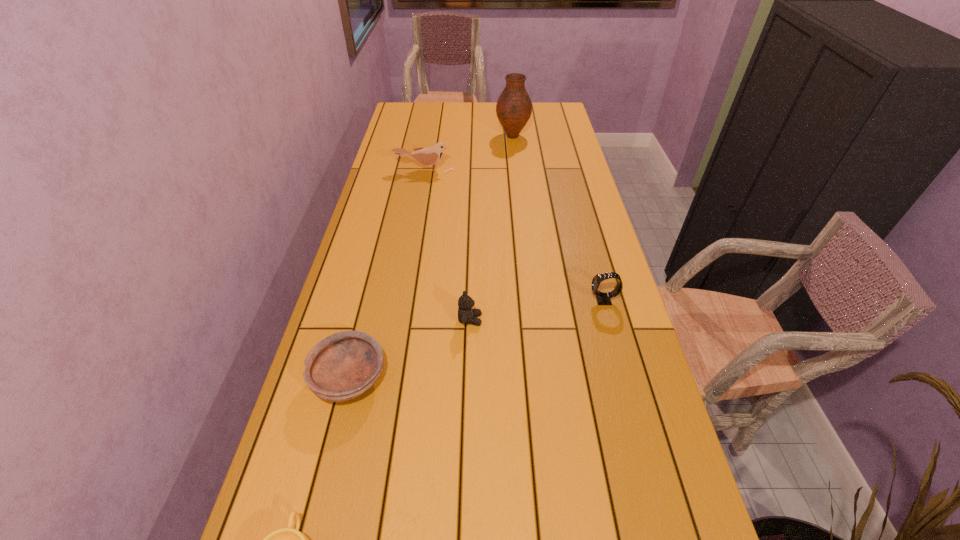
Locate an element on the screen. This screenshot has height=540, width=960. vacant space in between the teddy bear and the fifth farthest object is located at coordinates (410, 349).

This screenshot has height=540, width=960. I want to click on empty space between the bird and the rightmost object, so (514, 235).

Identify which object is the fourth closest to the farthest object. Please provide its 2D coordinates. Your answer should be formatted as a tuple, i.e. [(x, y)], where the tuple contains the x and y coordinates of a point satisfying the conditions above.

[(344, 365)]

This screenshot has height=540, width=960. Identify the location of object that stands as the second closest to the second shortest object. (289, 539).